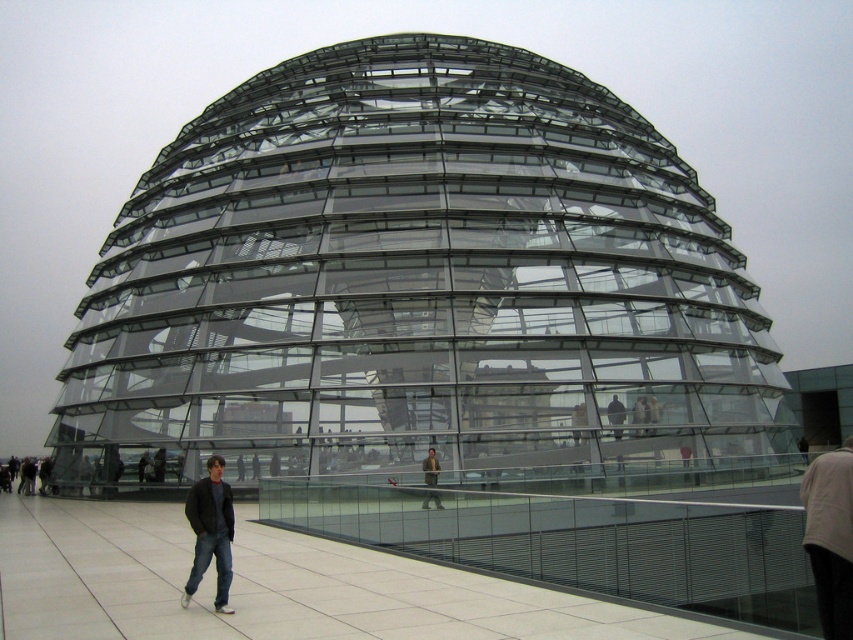
You are standing on the paved area near the Reichstag Dome and see the dark blue jeans at lower left and the dark gray jacket at center. Which object is nearer to you?

The dark blue jeans at lower left is closer to the viewer than the dark gray jacket at center.

You are standing at the center of the Reichstag Dome and see the point at coordinates (x=210, y=532). What object is located at that point?

The point at coordinates (x=210, y=532) corresponds to dark blue jeans at lower left.